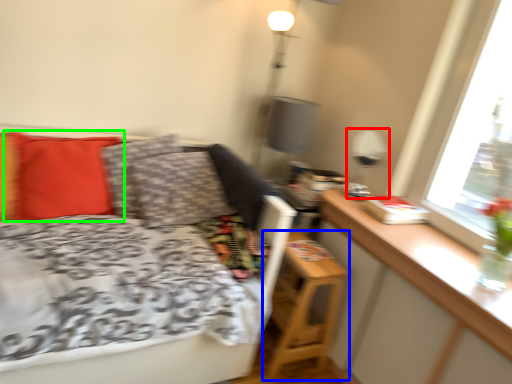
Question: Estimate the real-world distances between objects in this image. Which object is closer to table lamp (highlighted by a red box), nightstand (highlighted by a blue box) or pillow (highlighted by a green box)?

Choices:
 (A) nightstand
 (B) pillow

Answer: (A)